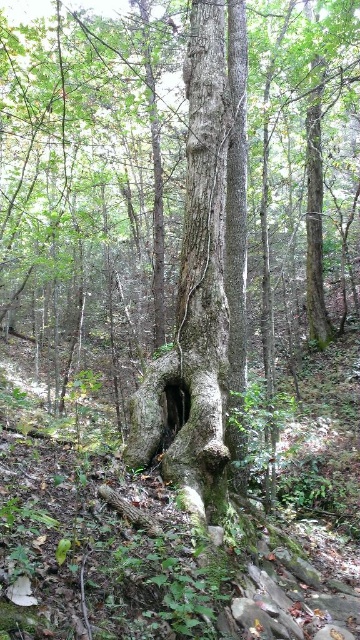
Question: Is rough bark tree trunk at center below smooth dark wood hole at center?

Choices:
 (A) no
 (B) yes

Answer: (A)

Question: Is rough bark tree trunk at center bigger than smooth dark wood hole at center?

Choices:
 (A) no
 (B) yes

Answer: (B)

Question: Is rough bark tree trunk at center smaller than smooth dark wood hole at center?

Choices:
 (A) no
 (B) yes

Answer: (A)

Question: Which of the following is the closest to the observer?

Choices:
 (A) smooth dark wood hole at center
 (B) rough bark tree trunk at center

Answer: (B)